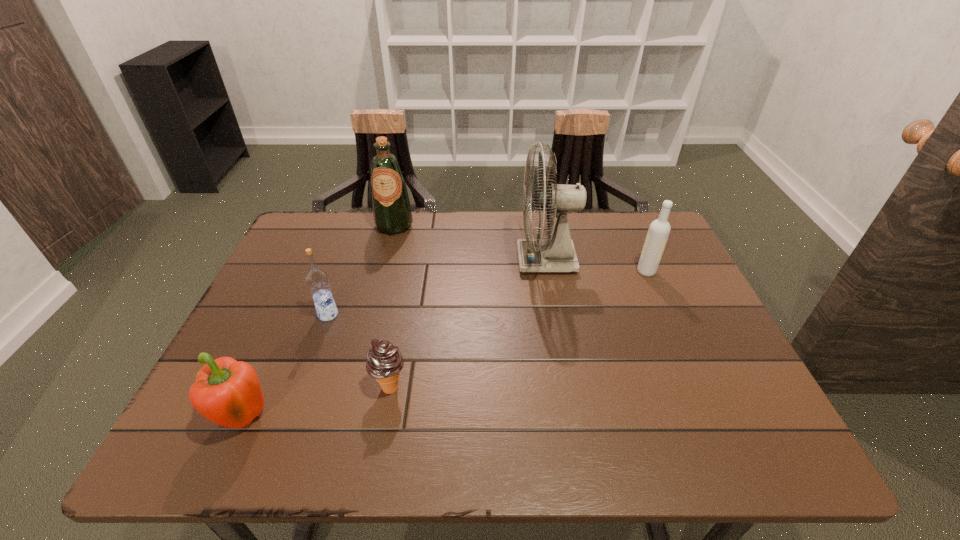
The image size is (960, 540). Identify the location of free spot located 0.290m on the front-facing side of the fan. (416, 260).

Locate an element on the screen. The height and width of the screenshot is (540, 960). free space located 0.360m on the front-facing side of the fan is located at coordinates (391, 260).

At what (x,y) coordinates should I click in order to perform the action: click on blank space located 0.270m on the front-facing side of the olive oil. Please return your answer as a coordinate pair (x, y). The image size is (960, 540). Looking at the image, I should click on (375, 299).

In order to click on free space located on the right of the right vodka in this screenshot , I will do `click(682, 271)`.

Image resolution: width=960 pixels, height=540 pixels. Identify the location of vacant region located on the front of the nearer vodka. (311, 362).

This screenshot has height=540, width=960. I want to click on free space located 0.160m on the back of the pepper, so click(x=282, y=336).

Locate an element on the screen. This screenshot has width=960, height=540. vacant point located on the right of the shortest object is located at coordinates (431, 387).

You are a GUI agent. You are given a task and a screenshot of the screen. Output one action in this format:
    pyautogui.click(x=<x>, y=<y>)
    Task: Click on the fan that is at the far edge
    Image resolution: width=960 pixels, height=540 pixels.
    Given the screenshot: What is the action you would take?
    pyautogui.click(x=556, y=253)

Where is `olive oil at the far edge`? olive oil at the far edge is located at coordinates (392, 215).

Locate an element on the screen. The height and width of the screenshot is (540, 960). object that is positioned at the near edge is located at coordinates coord(227,392).